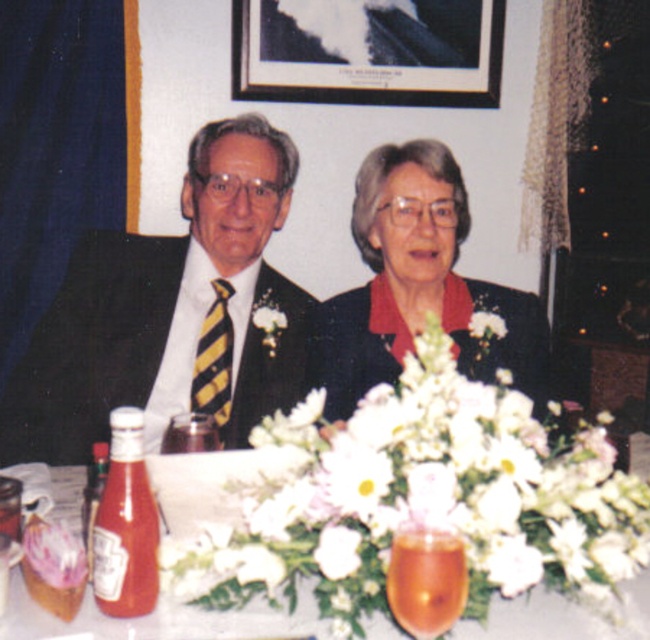
Locate an element on the screen. The height and width of the screenshot is (640, 650). matte black suit at left is located at coordinates (169, 312).

Does matte black suit at left come in front of matte glass bottle of ketchup at lower left?

No.

Locate an element on the screen. The image size is (650, 640). matte black suit at left is located at coordinates (169, 312).

The height and width of the screenshot is (640, 650). What are the coordinates of `matte black suit at left` in the screenshot? It's located at (169, 312).

Measure the distance between point [396,234] and camera.

Point [396,234] and camera are 5.84 feet apart.

Who is higher up, matte black jacket at center or translucent glass vase at center?

matte black jacket at center

Locate an element on the screen. matte black jacket at center is located at coordinates (417, 285).

Locate an element on the screen. white matte flower at center is located at coordinates (421, 500).

The image size is (650, 640). Find the location of `white matte flower at center`. white matte flower at center is located at coordinates (421, 500).